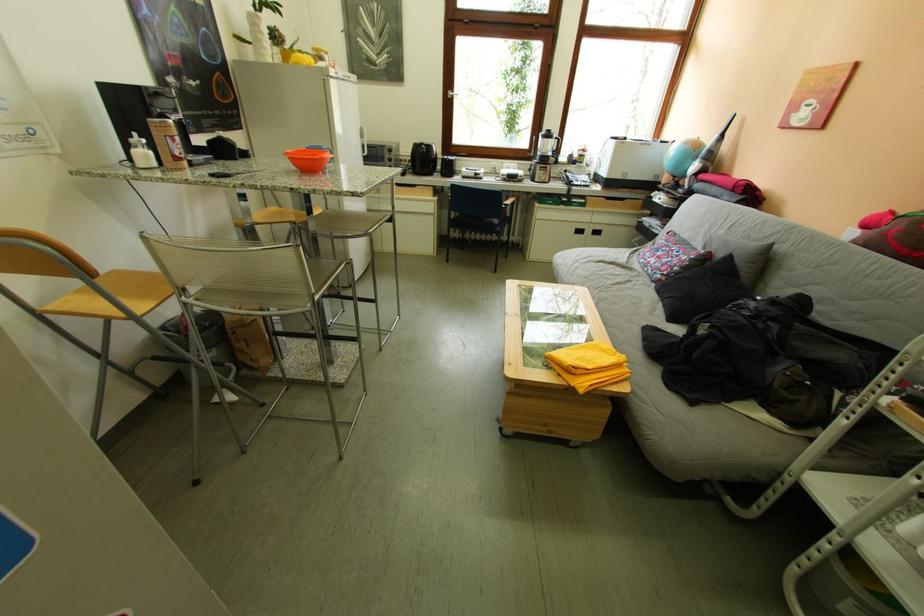
The width and height of the screenshot is (924, 616). What do you see at coordinates (479, 227) in the screenshot? I see `the blue chair sitting surface` at bounding box center [479, 227].